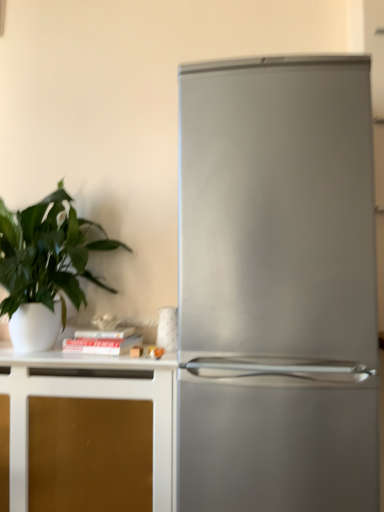
Question: Could you tell me if stainless steel refrigerator at right is turned towards green matte plant at left?

Choices:
 (A) no
 (B) yes

Answer: (A)

Question: From a real-world perspective, is stainless steel refrigerator at right over green matte plant at left?

Choices:
 (A) no
 (B) yes

Answer: (A)

Question: Is there a large distance between stainless steel refrigerator at right and green matte plant at left?

Choices:
 (A) yes
 (B) no

Answer: (B)

Question: From the image's perspective, is stainless steel refrigerator at right on green matte plant at left?

Choices:
 (A) yes
 (B) no

Answer: (B)

Question: Is stainless steel refrigerator at right taller than green matte plant at left?

Choices:
 (A) no
 (B) yes

Answer: (B)

Question: Is point (11, 486) positioned closer to the camera than point (235, 228)?

Choices:
 (A) closer
 (B) farther

Answer: (B)

Question: Looking at their shapes, would you say gold matte cabinet at lower left is wider or thinner than stainless steel refrigerator at right?

Choices:
 (A) wide
 (B) thin

Answer: (B)

Question: From the image's perspective, is gold matte cabinet at lower left positioned above or below stainless steel refrigerator at right?

Choices:
 (A) below
 (B) above

Answer: (A)

Question: From a real-world perspective, is gold matte cabinet at lower left positioned above or below stainless steel refrigerator at right?

Choices:
 (A) below
 (B) above

Answer: (A)

Question: In terms of size, does stainless steel refrigerator at right appear bigger or smaller than gold matte cabinet at lower left?

Choices:
 (A) big
 (B) small

Answer: (A)

Question: Considering the positions of stainless steel refrigerator at right and gold matte cabinet at lower left in the image, is stainless steel refrigerator at right taller or shorter than gold matte cabinet at lower left?

Choices:
 (A) short
 (B) tall

Answer: (B)

Question: Considering the relative positions of stainless steel refrigerator at right and gold matte cabinet at lower left in the image provided, is stainless steel refrigerator at right to the left or to the right of gold matte cabinet at lower left?

Choices:
 (A) right
 (B) left

Answer: (A)

Question: From the image's perspective, relative to gold matte cabinet at lower left, is stainless steel refrigerator at right above or below?

Choices:
 (A) above
 (B) below

Answer: (A)

Question: Is gold matte cabinet at lower left situated inside green matte plant at left or outside?

Choices:
 (A) outside
 (B) inside

Answer: (A)

Question: Does point (155, 431) appear closer or farther from the camera than point (72, 282)?

Choices:
 (A) closer
 (B) farther

Answer: (A)